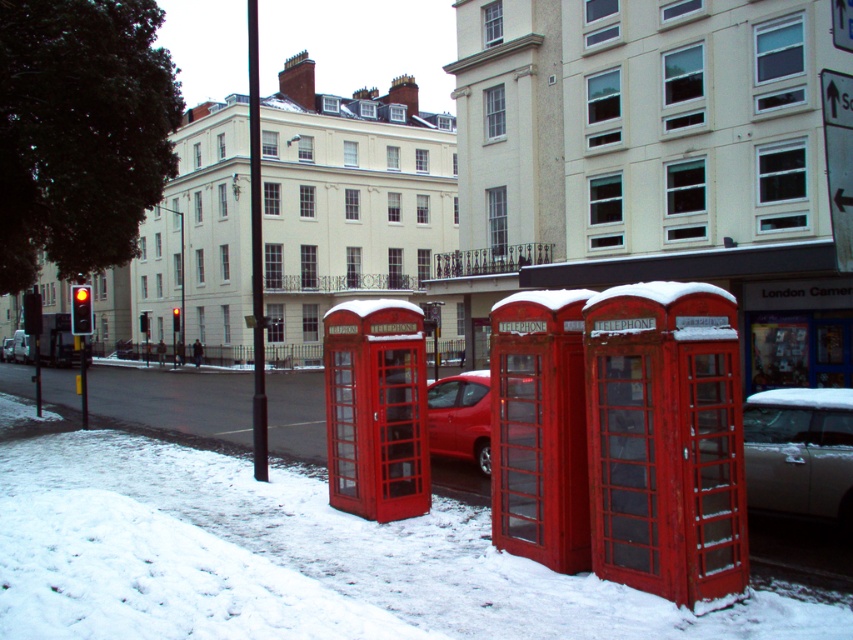
Question: Which is farther from the matte red telephone booth at center?

Choices:
 (A) shiny red car at center
 (B) snowy red phone booth at center
 (C) matte glass telephone booth at center

Answer: (A)

Question: Which object is positioned closest to the white glossy car at lower right?

Choices:
 (A) matte glass telephone booth at center
 (B) matte red telephone booth at center
 (C) shiny red car at center
 (D) snowy red phone booth at center

Answer: (B)

Question: Does matte glass telephone booth at center have a greater width compared to shiny red car at center?

Choices:
 (A) yes
 (B) no

Answer: (A)

Question: Based on their relative distances, which object is farther from the shiny red car at center?

Choices:
 (A) white glossy car at lower right
 (B) matte glass telephone booth at center

Answer: (A)

Question: Does matte glass telephone booth at center have a lesser width compared to shiny red car at center?

Choices:
 (A) no
 (B) yes

Answer: (A)

Question: Does snowy red phone booth at center appear under matte red telephone booth at center?

Choices:
 (A) no
 (B) yes

Answer: (B)